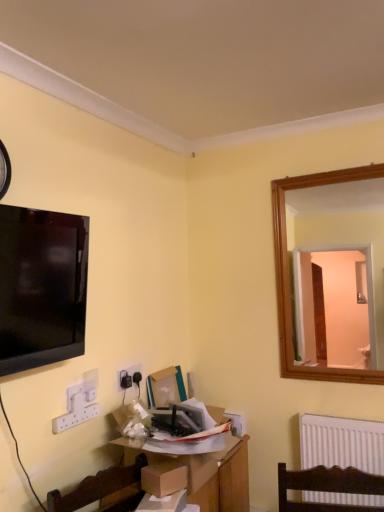
You are a GUI agent. You are given a task and a screenshot of the screen. Output one action in this format:
    pyautogui.click(x=<x>, y=<y>)
    Task: Click on the wooden table at center
    The image size is (384, 512).
    Given the screenshot: What is the action you would take?
    pyautogui.click(x=207, y=474)

Based on the photo, in order to face wooden table at center, should I rotate leftwards or rightwards?

You should look left and rotate roughly 1.757 degrees.

Image resolution: width=384 pixels, height=512 pixels. Describe the element at coordinates (129, 378) in the screenshot. I see `white plastic electric outlet at lower left` at that location.

What is the approximate width of matte black tv at upper left?

matte black tv at upper left is 15.92 centimeters wide.

Where is `cardboard box at center`? cardboard box at center is located at coordinates (165, 387).

Describe the element at coordinates (164, 478) in the screenshot. I see `brown cardboard box at center` at that location.

Find the location of `wooden table at center`. wooden table at center is located at coordinates (207, 474).

From the image's perspective, is brown cardboard box at center below matte black tv at upper left?

Yes, from the image's perspective, brown cardboard box at center is below matte black tv at upper left.

Which object is further away from the camera, brown cardboard box at center or matte black tv at upper left?

brown cardboard box at center is more distant.

From a real-world perspective, is brown cardboard box at center above or below matte black tv at upper left?

From a real-world perspective, brown cardboard box at center is physically below matte black tv at upper left.

How different are the orientations of brown cardboard box at center and matte black tv at upper left in degrees?

18.1 degrees separate the facing orientations of brown cardboard box at center and matte black tv at upper left.

From a real-world perspective, who is located lower, brown cardboard box at center or cardboard box at center?

brown cardboard box at center is physically lower.

Is brown cardboard box at center taller or shorter than cardboard box at center?

In the image, brown cardboard box at center appears to be shorter than cardboard box at center.

Considering the sizes of objects brown cardboard box at center and cardboard box at center in the image provided, who is thinner, brown cardboard box at center or cardboard box at center?

cardboard box at center.

Consider the image. Considering the sizes of objects black plastic clock at upper left and white plastic electric outlet at lower left in the image provided, who is smaller, black plastic clock at upper left or white plastic electric outlet at lower left?

Smaller between the two is white plastic electric outlet at lower left.

Is black plastic clock at upper left not inside white plastic electric outlet at lower left?

Yes, black plastic clock at upper left is not within white plastic electric outlet at lower left.

Identify the location of electric outlet below the black plastic clock at upper left (from the image's perspective). This screenshot has height=512, width=384. point(129,378).

Can you confirm if black plastic clock at upper left is shorter than white plastic electric outlet at lower left?

Incorrect, the height of black plastic clock at upper left does not fall short of that of white plastic electric outlet at lower left.

Measure the distance from wooden table at center to white plastic electric outlet at lower left.

wooden table at center is 50.14 centimeters from white plastic electric outlet at lower left.

What's the angular difference between wooden table at center and white plastic electric outlet at lower left's facing directions?

wooden table at center and white plastic electric outlet at lower left are facing 1.78 degrees away from each other.

From a real-world perspective, which is physically below, wooden table at center or white plastic electric outlet at lower left?

From a 3D spatial view, wooden table at center is below.

Can you confirm if wooden table at center is thinner than white plastic electric outlet at lower left?

No, wooden table at center is not thinner than white plastic electric outlet at lower left.

How different are the orientations of black plastic clock at upper left and cardboard box at center in degrees?

The angle between the facing direction of black plastic clock at upper left and the facing direction of cardboard box at center is 2.69 degrees.

Is black plastic clock at upper left outside of cardboard box at center?

black plastic clock at upper left lies outside cardboard box at center's area.

Does black plastic clock at upper left lie in front of cardboard box at center?

That is True.

Is black plastic clock at upper left facing towards cardboard box at center?

No, black plastic clock at upper left does not turn towards cardboard box at center.

Is white plastic electric outlet at lower left positioned before wooden table at center?

No.

Considering the sizes of objects white plastic electric outlet at lower left and wooden table at center in the image provided, who is smaller, white plastic electric outlet at lower left or wooden table at center?

white plastic electric outlet at lower left.

From a real-world perspective, is white plastic electric outlet at lower left on wooden table at center?

Indeed, from a real-world perspective, white plastic electric outlet at lower left stands above wooden table at center.

From the image's perspective, is matte black tv at upper left located beneath cardboard box at center?

No, from the image's perspective, matte black tv at upper left is not beneath cardboard box at center.

Does matte black tv at upper left touch cardboard box at center?

matte black tv at upper left is not next to cardboard box at center, and they're not touching.

Is matte black tv at upper left facing towards cardboard box at center?

No.

Is matte black tv at upper left in front of or behind cardboard box at center in the image?

Visually, matte black tv at upper left is located in front of cardboard box at center.

Find the location of a particular element. television lying on the left of brown cardboard box at center is located at coordinates (41, 287).

Find the location of a particular element. cardboard box on the right of cardboard box at center is located at coordinates (164, 478).

Based on their spatial positions, is white plastic electric outlet at lower left or matte black tv at upper left further from black plastic clock at upper left?

white plastic electric outlet at lower left is positioned further to the anchor black plastic clock at upper left.

Based on the photo, considering their positions, is white plastic electric outlet at lower left positioned closer to matte black tv at upper left than wooden table at center?

white plastic electric outlet at lower left is positioned closer to the anchor matte black tv at upper left.

When comparing their distances from brown cardboard box at center, does matte black tv at upper left or wooden table at center seem closer?

wooden table at center.

When comparing their distances from cardboard box at center, does black plastic clock at upper left or matte black tv at upper left seem closer?

Based on the image, matte black tv at upper left appears to be nearer to cardboard box at center.

Considering their positions, is black plastic clock at upper left positioned further to white plastic electric outlet at lower left than wooden table at center?

The object further to white plastic electric outlet at lower left is black plastic clock at upper left.

From the image, which object appears to be farther from matte black tv at upper left, black plastic clock at upper left or white plastic electric outlet at lower left?

white plastic electric outlet at lower left lies further to matte black tv at upper left than the other object.

When comparing their distances from cardboard box at center, does wooden table at center or white plastic electric outlet at lower left seem further?

wooden table at center is positioned further to the anchor cardboard box at center.

Which object lies further to the anchor point cardboard box at center, white plastic electric outlet at lower left or brown cardboard box at center?

Based on the image, brown cardboard box at center appears to be further to cardboard box at center.

The width and height of the screenshot is (384, 512). Find the location of `table located between brown cardboard box at center and cardboard box at center in the depth direction`. table located between brown cardboard box at center and cardboard box at center in the depth direction is located at coordinates (207, 474).

The width and height of the screenshot is (384, 512). I want to click on electric outlet between brown cardboard box at center and cardboard box at center from front to back, so click(x=129, y=378).

Where is `table between matte black tv at upper left and cardboard box at center from front to back`? table between matte black tv at upper left and cardboard box at center from front to back is located at coordinates (207, 474).

Where is `box between black plastic clock at upper left and wooden table at center from top to bottom`? The height and width of the screenshot is (512, 384). box between black plastic clock at upper left and wooden table at center from top to bottom is located at coordinates (165, 387).